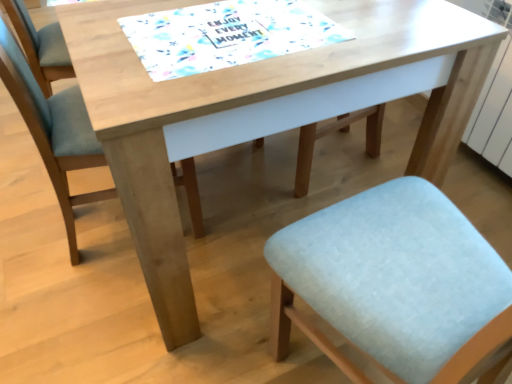
Identify the location of vacant space in front of white paper placemat at center. Image resolution: width=512 pixels, height=384 pixels. (209, 84).